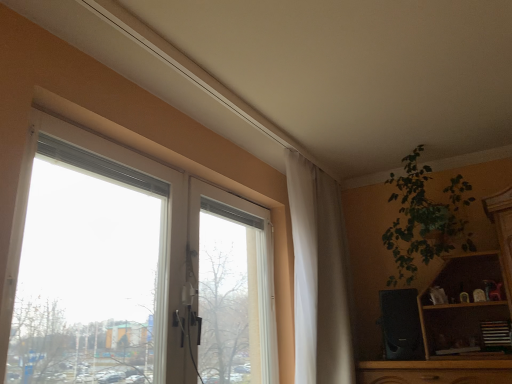
Question: Is green leafy plant at upper right positioned beyond the bounds of white sheer curtain at center?

Choices:
 (A) yes
 (B) no

Answer: (A)

Question: Can you confirm if green leafy plant at upper right is shorter than white sheer curtain at center?

Choices:
 (A) no
 (B) yes

Answer: (B)

Question: Does green leafy plant at upper right have a greater height compared to white sheer curtain at center?

Choices:
 (A) yes
 (B) no

Answer: (B)

Question: Is green leafy plant at upper right aimed at white sheer curtain at center?

Choices:
 (A) no
 (B) yes

Answer: (A)

Question: Is green leafy plant at upper right to the right of white sheer curtain at center from the viewer's perspective?

Choices:
 (A) no
 (B) yes

Answer: (B)

Question: Does green leafy plant at upper right have a greater width compared to white sheer curtain at center?

Choices:
 (A) no
 (B) yes

Answer: (B)

Question: Is transparent glass window at upper left not inside white sheer curtain at center?

Choices:
 (A) yes
 (B) no

Answer: (A)

Question: Does transparent glass window at upper left lie in front of white sheer curtain at center?

Choices:
 (A) no
 (B) yes

Answer: (B)

Question: Are transparent glass window at upper left and white sheer curtain at center making contact?

Choices:
 (A) yes
 (B) no

Answer: (B)

Question: Is transparent glass window at upper left shorter than white sheer curtain at center?

Choices:
 (A) no
 (B) yes

Answer: (B)

Question: Does transparent glass window at upper left lie behind white sheer curtain at center?

Choices:
 (A) no
 (B) yes

Answer: (A)

Question: Is transparent glass window at upper left oriented towards white sheer curtain at center?

Choices:
 (A) no
 (B) yes

Answer: (B)

Question: Is white sheer curtain at center turned away from transparent glass window at upper left?

Choices:
 (A) yes
 (B) no

Answer: (A)